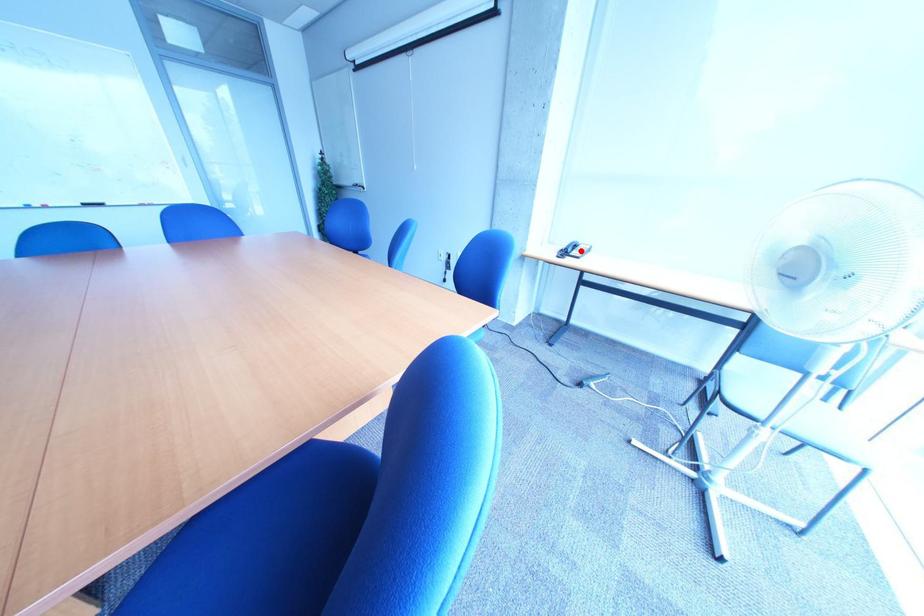
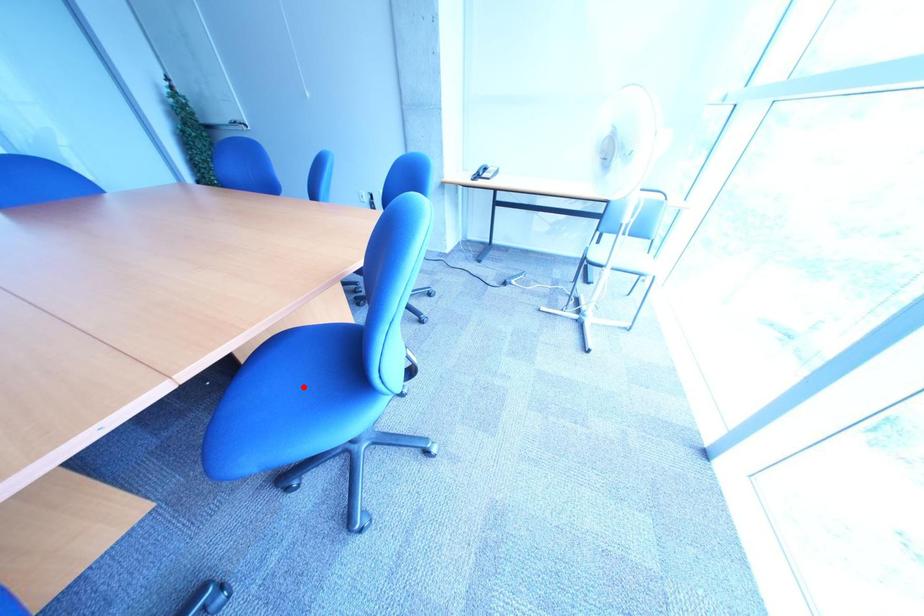
In the scene shown: I am providing you with two images of the same scene from different viewpoints. A red point is marked on the first image and another point is marked on the second image. Is the marked point in image1 the same physical position as the marked point in image2?

No